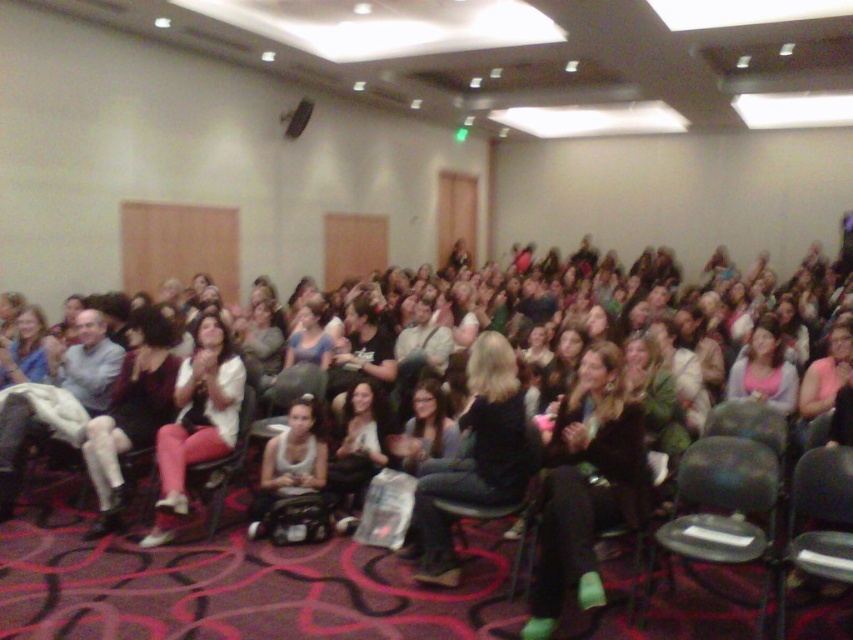
Which is above, pink fabric pants at center or matte white shirt at center?

pink fabric pants at center is higher up.

Does pink fabric pants at center have a lesser height compared to matte white shirt at center?

No.

I want to click on pink fabric pants at center, so click(x=196, y=420).

Is pink fabric pants at center positioned at the back of matte black jacket at center?

No, it is in front of matte black jacket at center.

The height and width of the screenshot is (640, 853). What are the coordinates of `pink fabric pants at center` in the screenshot? It's located at pyautogui.click(x=196, y=420).

Who is shorter, metallic gray chair at lower right or pink matte shirt at center?

pink matte shirt at center is shorter.

Does point (763, 545) come behind point (735, 372)?

No, (763, 545) is in front of (735, 372).

The width and height of the screenshot is (853, 640). What do you see at coordinates (718, 504) in the screenshot? I see `metallic gray chair at lower right` at bounding box center [718, 504].

Identify the location of metallic gray chair at lower right. (718, 504).